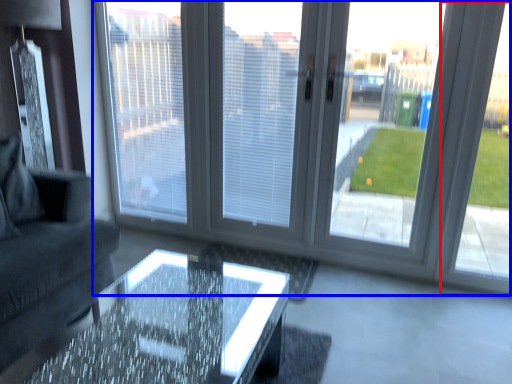
Question: Which object is further to the camera taking this photo, window frame (highlighted by a red box) or window (highlighted by a blue box)?

Choices:
 (A) window frame
 (B) window

Answer: (A)